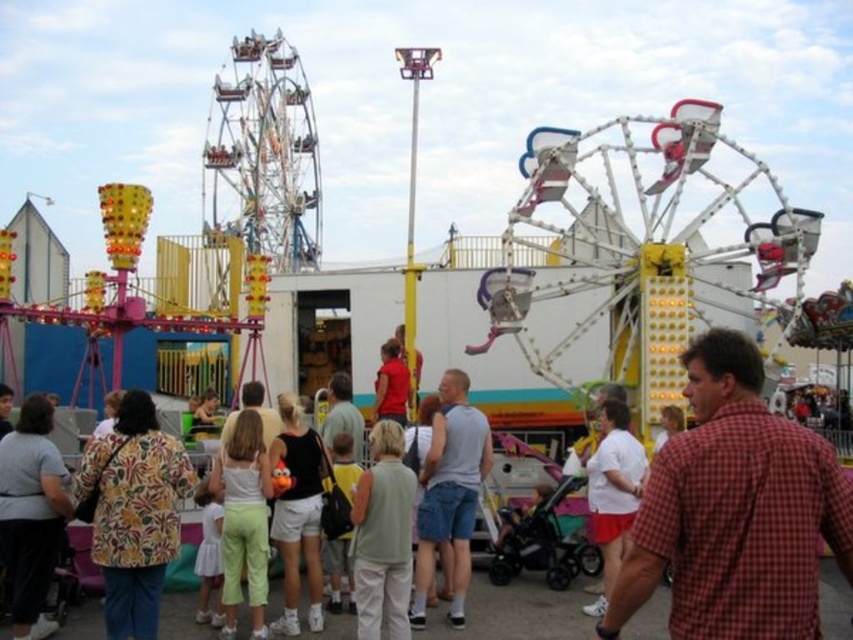
Question: Considering the real-world distances, which object is farthest from the light beige shorts at center?

Choices:
 (A) gray cotton tank top at center
 (B) white matte shirt at center
 (C) red checkered shirt at center

Answer: (B)

Question: Is floral print shirt at center thinner than gray cotton tank top at center?

Choices:
 (A) no
 (B) yes

Answer: (A)

Question: Can you confirm if red checkered shirt at center is positioned above light beige shorts at center?

Choices:
 (A) yes
 (B) no

Answer: (A)

Question: Which object is farther from the camera taking this photo?

Choices:
 (A) metallic silver carousel at center
 (B) red checkered shirt at center

Answer: (A)

Question: Can you confirm if metallic silver carousel at center is smaller than white matte shirt at center?

Choices:
 (A) no
 (B) yes

Answer: (A)

Question: Which point is farther from the camera taking this photo?

Choices:
 (A) pos(735,196)
 (B) pos(45,570)

Answer: (A)